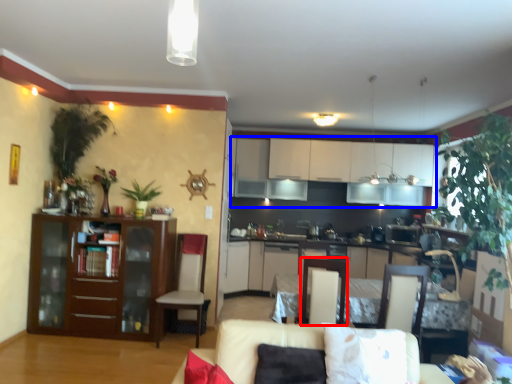
Question: Which object is closer to the camera taking this photo, armchair (highlighted by a red box) or cabinetry (highlighted by a blue box)?

Choices:
 (A) armchair
 (B) cabinetry

Answer: (A)